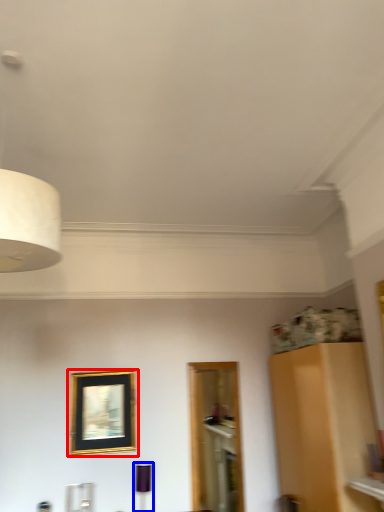
Question: Which object is further to the camera taking this photo, picture frame (highlighted by a red box) or lamp (highlighted by a blue box)?

Choices:
 (A) picture frame
 (B) lamp

Answer: (A)